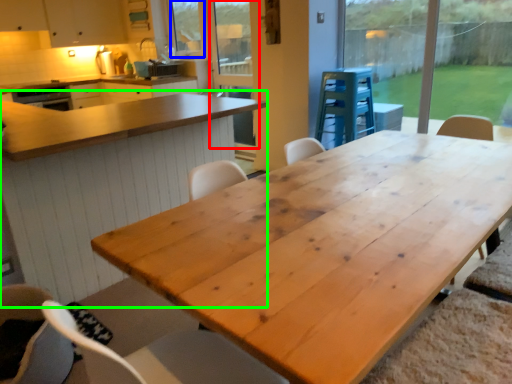
Question: Considering the real-world distances, which object is closest to screen door (highlighted by a red box)? window screen (highlighted by a blue box) or table (highlighted by a green box).

Choices:
 (A) window screen
 (B) table

Answer: (A)